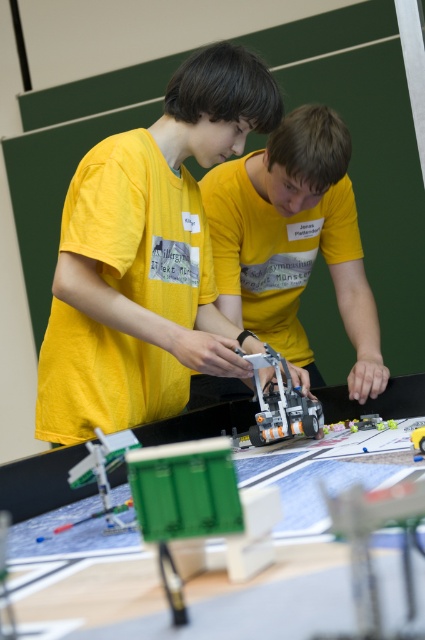
Does matte yellow shirt at center have a lesser width compared to yellow matte shirt at center?

No.

Can you confirm if matte yellow shirt at center is smaller than yellow matte shirt at center?

Indeed, matte yellow shirt at center has a smaller size compared to yellow matte shirt at center.

What do you see at coordinates (146, 257) in the screenshot?
I see `matte yellow shirt at center` at bounding box center [146, 257].

Find the location of a particular element. Image resolution: width=425 pixels, height=640 pixels. matte yellow shirt at center is located at coordinates (146, 257).

Is matte yellow shirt at center closer to the viewer compared to translucent orange plastic robot at center?

Yes, it is in front of translucent orange plastic robot at center.

Between matte yellow shirt at center and translucent orange plastic robot at center, which one is positioned lower?

Positioned lower is translucent orange plastic robot at center.

Is point (127, 339) more distant than point (294, 404)?

No, (127, 339) is closer to viewer.

Locate an element on the screen. The image size is (425, 640). matte yellow shirt at center is located at coordinates (146, 257).

You are a GUI agent. You are given a task and a screenshot of the screen. Output one action in this format:
    pyautogui.click(x=<x>, y=<y>)
    Task: Click on the yellow matte shirt at center
    This screenshot has width=425, height=640.
    Given the screenshot: What is the action you would take?
    pyautogui.click(x=294, y=241)

Which is in front, point (300, 348) or point (309, 426)?

Point (309, 426)

Does point (348, 156) come closer to viewer compared to point (286, 396)?

No, (348, 156) is further to viewer.

Where is `yellow matte shirt at center`? This screenshot has height=640, width=425. yellow matte shirt at center is located at coordinates (294, 241).